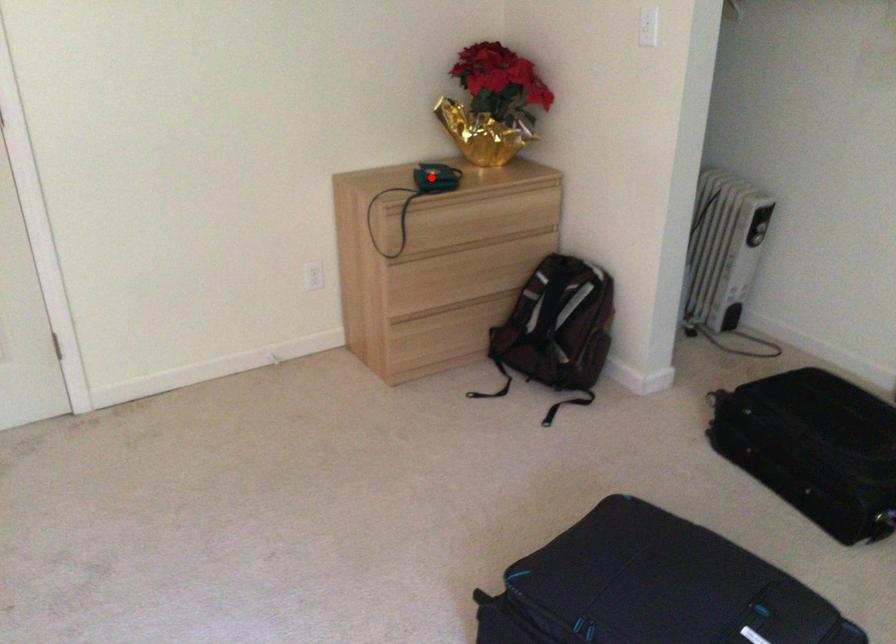
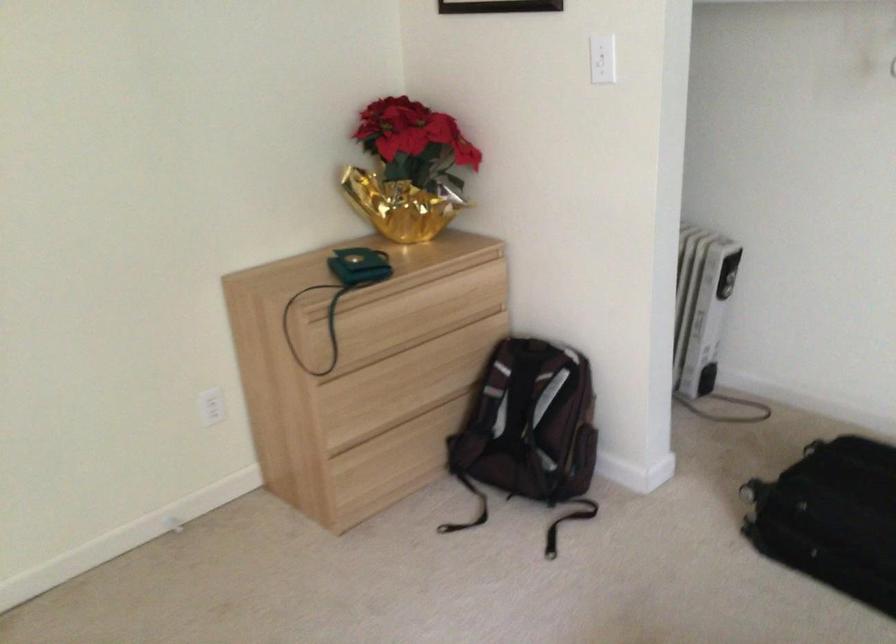
Question: I am providing you with two images of the same scene from different viewpoints. A red point is shown in image1. For the corresponding object point in image2, is it positioned nearer or farther from the camera?

Choices:
 (A) Nearer
 (B) Farther

Answer: (A)